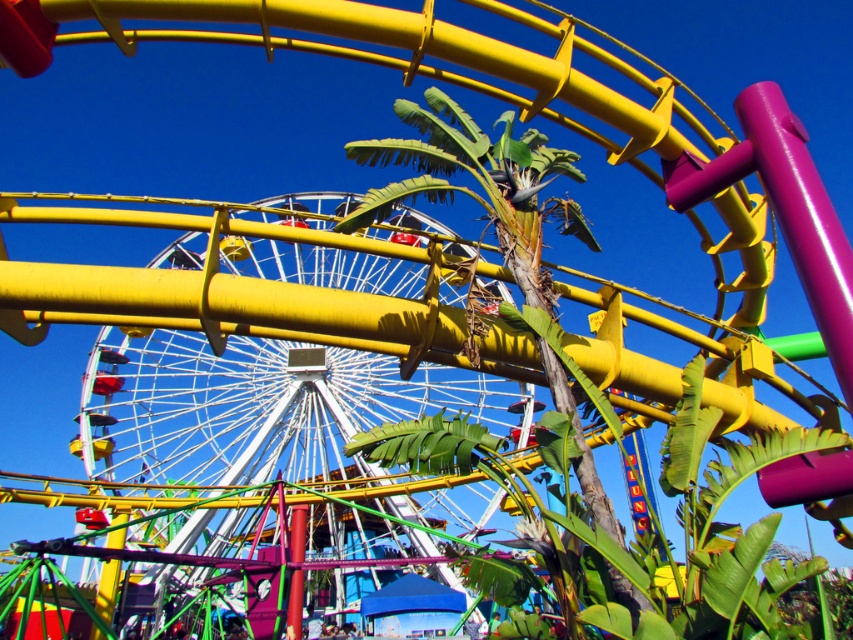
Can you confirm if metallic white ferris wheel at center is positioned to the left of green leafy palm tree at center?

Indeed, metallic white ferris wheel at center is positioned on the left side of green leafy palm tree at center.

Does metallic white ferris wheel at center have a lesser height compared to green leafy palm tree at center?

No.

The width and height of the screenshot is (853, 640). What are the coordinates of `metallic white ferris wheel at center` in the screenshot? It's located at (285, 428).